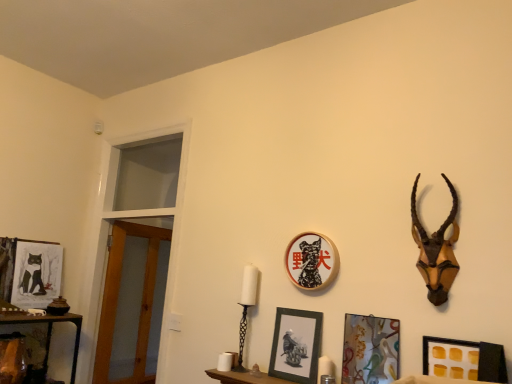
Image resolution: width=512 pixels, height=384 pixels. Describe the element at coordinates (36, 274) in the screenshot. I see `matte black picture frame at left, the first picture frame positioned from the left` at that location.

This screenshot has width=512, height=384. I want to click on metallic glass picture frame at lower right, which appears as the 4th picture frame when viewed from the left, so click(x=370, y=349).

Locate an element on the screen. This screenshot has width=512, height=384. matte black picture frame at center, which is counted as the 3th picture frame, starting from the back is located at coordinates tap(296, 345).

How much space does matte black picture frame at center, which is the 3th picture frame from right to left, occupy horizontally?

matte black picture frame at center, which is the 3th picture frame from right to left, is 2.17 inches in width.

This screenshot has height=384, width=512. Describe the element at coordinates (464, 359) in the screenshot. I see `black matte picture frame at lower right, which is the fifth picture frame in back-to-front order` at that location.

This screenshot has height=384, width=512. I want to click on matte wood shelf at lower center, so click(244, 378).

Is point (381, 370) farther from camera compared to point (18, 268)?

That is False.

Is metallic glass picture frame at lower right, arranged as the 2th picture frame when viewed from the right, positioned with its back to matte black picture frame at left, which is the fifth picture frame from right to left?

metallic glass picture frame at lower right, arranged as the 2th picture frame when viewed from the right, is not turned away from matte black picture frame at left, which is the fifth picture frame from right to left.

From the image's perspective, between metallic glass picture frame at lower right, which appears as the 4th picture frame when viewed from the left, and matte black picture frame at left, the 1th picture frame from the back, which one is located above?

From the image's view, matte black picture frame at left, the 1th picture frame from the back, is above.

Does metallic glass picture frame at lower right, positioned as the second picture frame in front-to-back order, have a lesser width compared to matte black picture frame at left, the first picture frame positioned from the left?

Correct, the width of metallic glass picture frame at lower right, positioned as the second picture frame in front-to-back order, is less than that of matte black picture frame at left, the first picture frame positioned from the left.

Is black matte picture frame at lower right, which is the fifth picture frame in back-to-front order, situated inside matte black picture frame at center, positioned as the third picture frame in left-to-right order, or outside?

black matte picture frame at lower right, which is the fifth picture frame in back-to-front order, is outside matte black picture frame at center, positioned as the third picture frame in left-to-right order.

In the scene shown: Is black matte picture frame at lower right, which is the fifth picture frame in back-to-front order, turned away from matte black picture frame at center, positioned as the third picture frame in left-to-right order?

No, black matte picture frame at lower right, which is the fifth picture frame in back-to-front order,'s orientation is not away from matte black picture frame at center, positioned as the third picture frame in left-to-right order.

From a real-world perspective, which is physically above, black matte picture frame at lower right, which is the fifth picture frame in back-to-front order, or matte black picture frame at center, positioned as the third picture frame in left-to-right order?

matte black picture frame at center, positioned as the third picture frame in left-to-right order.

Can you confirm if black matte picture frame at lower right, arranged as the 5th picture frame when viewed from the left, is smaller than matte black picture frame at center, which is the 3th picture frame from right to left?

Correct, black matte picture frame at lower right, arranged as the 5th picture frame when viewed from the left, occupies less space than matte black picture frame at center, which is the 3th picture frame from right to left.

What's the angular difference between metallic glass picture frame at lower right, positioned as the second picture frame in front-to-back order, and brown wooden antelope head at upper right's facing directions?

The facing directions of metallic glass picture frame at lower right, positioned as the second picture frame in front-to-back order, and brown wooden antelope head at upper right are 0.0532 degrees apart.

From the image's perspective, which picture frame is the 3rd one below the brown wooden antelope head at upper right? Please provide its 2D coordinates.

[(370, 349)]

Considering the points (361, 322) and (456, 238), which point is behind, point (361, 322) or point (456, 238)?

The point (361, 322) is behind.

Can you confirm if matte wood shelf at lower center is smaller than black matte picture frame at lower right, arranged as the 5th picture frame when viewed from the left?

No, matte wood shelf at lower center is not smaller than black matte picture frame at lower right, arranged as the 5th picture frame when viewed from the left.

Is matte wood shelf at lower center in front of black matte picture frame at lower right, which is the fifth picture frame in back-to-front order?

That is False.

Is point (264, 380) farther from viewer compared to point (493, 369)?

Yes, point (264, 380) is behind point (493, 369).

You are a GUI agent. You are given a task and a screenshot of the screen. Output one action in this format:
    pyautogui.click(x=<x>, y=<y>)
    Task: Click on the furniture that is under the black matte picture frame at lower right, which ranks as the 1th picture frame in right-to-left order (from a real-world perspective)
    Image resolution: width=512 pixels, height=384 pixels.
    Given the screenshot: What is the action you would take?
    pyautogui.click(x=244, y=378)

Which is nearer, (327, 249) or (490, 381)?

Point (327, 249) is farther from the camera than point (490, 381).

Looking at this image, from the image's perspective, is matte black picture frame at center, which is the 3th picture frame from right to left, located above or below black matte picture frame at lower right, which ranks as the 1th picture frame in right-to-left order?

Based on their image positions, matte black picture frame at center, which is the 3th picture frame from right to left, is located above black matte picture frame at lower right, which ranks as the 1th picture frame in right-to-left order.

This screenshot has width=512, height=384. In order to click on picture frame that is the 3rd one when counting forward from the matte black picture frame at center, acting as the 2th picture frame starting from the back in this screenshot , I will do `click(464, 359)`.

From a real-world perspective, is matte black picture frame at center, acting as the 2th picture frame starting from the back, on black matte picture frame at lower right, the first picture frame positioned from the front?

Yes, from a real-world perspective, matte black picture frame at center, acting as the 2th picture frame starting from the back, is on top of black matte picture frame at lower right, the first picture frame positioned from the front.

From the image's perspective, which one is positioned lower, brown wooden antelope head at upper right or matte black picture frame at center, positioned as the third picture frame in left-to-right order?

From the image's view, matte black picture frame at center, positioned as the third picture frame in left-to-right order, is below.

Which is closer, (x=432, y=248) or (x=327, y=253)?

The point (x=432, y=248) is more forward.

From a real-world perspective, which is physically above, brown wooden antelope head at upper right or matte black picture frame at center, the fourth picture frame when ordered from front to back?

In real-world perspective, brown wooden antelope head at upper right is above.

Does brown wooden antelope head at upper right have a smaller size compared to matte black picture frame at center, which is the 3th picture frame from right to left?

No.

Looking at this image, does metallic glass picture frame at lower right, arranged as the 2th picture frame when viewed from the right, have a greater width compared to matte wood shelf at lower center?

In fact, metallic glass picture frame at lower right, arranged as the 2th picture frame when viewed from the right, might be narrower than matte wood shelf at lower center.

Between metallic glass picture frame at lower right, which is the 4th picture frame in back-to-front order, and matte wood shelf at lower center, which one has less height?

Standing shorter between the two is matte wood shelf at lower center.

From the image's perspective, which one is positioned lower, metallic glass picture frame at lower right, positioned as the second picture frame in front-to-back order, or matte wood shelf at lower center?

matte wood shelf at lower center.

Is point (394, 348) positioned before point (256, 376)?

Yes, point (394, 348) is closer to viewer.

Locate an element on the screen. the 1st picture frame directly above the metallic glass picture frame at lower right, which appears as the 4th picture frame when viewed from the left (from a real-world perspective) is located at coordinates (36, 274).

Locate an element on the screen. This screenshot has width=512, height=384. the 3rd picture frame below when counting from the matte black picture frame at center, positioned as the third picture frame in left-to-right order (from the image's perspective) is located at coordinates (464, 359).

Considering their positions, is black matte picture frame at lower right, arranged as the 5th picture frame when viewed from the left, positioned closer to metallic glass picture frame at lower right, positioned as the second picture frame in front-to-back order, than matte black picture frame at center, the fourth picture frame when ordered from front to back?

Among the two, black matte picture frame at lower right, arranged as the 5th picture frame when viewed from the left, is located nearer to metallic glass picture frame at lower right, positioned as the second picture frame in front-to-back order.

From the picture: Considering their positions, is matte black picture frame at left, the first picture frame positioned from the left, positioned further to black matte picture frame at lower right, which is the fifth picture frame in back-to-front order, than matte wood shelf at lower center?

matte black picture frame at left, the first picture frame positioned from the left, is further to black matte picture frame at lower right, which is the fifth picture frame in back-to-front order.

From the picture: Which object lies nearer to the anchor point matte black picture frame at center, positioned as the third picture frame in left-to-right order, metallic glass picture frame at lower right, positioned as the second picture frame in front-to-back order, or brown wooden antelope head at upper right?

Based on the image, metallic glass picture frame at lower right, positioned as the second picture frame in front-to-back order, appears to be nearer to matte black picture frame at center, positioned as the third picture frame in left-to-right order.

Based on their spatial positions, is brown wooden antelope head at upper right or matte wood shelf at lower center closer to metallic glass picture frame at lower right, which appears as the 4th picture frame when viewed from the left?

brown wooden antelope head at upper right lies closer to metallic glass picture frame at lower right, which appears as the 4th picture frame when viewed from the left, than the other object.

From the picture: Considering their positions, is matte wood shelf at lower center positioned further to black matte picture frame at lower right, arranged as the 5th picture frame when viewed from the left, than matte black picture frame at left, the first picture frame positioned from the left?

→ Based on the image, matte black picture frame at left, the first picture frame positioned from the left, appears to be further to black matte picture frame at lower right, arranged as the 5th picture frame when viewed from the left.

Based on their spatial positions, is black matte picture frame at lower right, which is the fifth picture frame in back-to-front order, or metallic glass picture frame at lower right, arranged as the 2th picture frame when viewed from the right, closer to matte black picture frame at center, acting as the 2th picture frame starting from the back?

metallic glass picture frame at lower right, arranged as the 2th picture frame when viewed from the right, is positioned closer to the anchor matte black picture frame at center, acting as the 2th picture frame starting from the back.

From the image, which object appears to be farther from brown wooden antelope head at upper right, matte black picture frame at center, acting as the 2th picture frame starting from the back, or matte black picture frame at left, marked as the fifth picture frame in a front-to-back arrangement?

Among the two, matte black picture frame at left, marked as the fifth picture frame in a front-to-back arrangement, is located further to brown wooden antelope head at upper right.

Which object lies nearer to the anchor point brown wooden antelope head at upper right, matte black picture frame at left, the 1th picture frame from the back, or matte wood shelf at lower center?

matte wood shelf at lower center is closer to brown wooden antelope head at upper right.

Where is `furniture between matte black picture frame at left, the first picture frame positioned from the left, and black matte picture frame at lower right, which is the fifth picture frame in back-to-front order, from left to right`? The width and height of the screenshot is (512, 384). furniture between matte black picture frame at left, the first picture frame positioned from the left, and black matte picture frame at lower right, which is the fifth picture frame in back-to-front order, from left to right is located at coordinates (244, 378).

Find the location of a particular element. This screenshot has width=512, height=384. furniture between matte black picture frame at left, the 1th picture frame from the back, and brown wooden antelope head at upper right is located at coordinates (x=244, y=378).

Find the location of a particular element. The height and width of the screenshot is (384, 512). picture frame between matte black picture frame at center, acting as the 2th picture frame starting from the back, and black matte picture frame at lower right, the first picture frame positioned from the front, in the horizontal direction is located at coordinates (370, 349).

The width and height of the screenshot is (512, 384). Identify the location of antelope between matte wood shelf at lower center and black matte picture frame at lower right, arranged as the 5th picture frame when viewed from the left, in the horizontal direction. (436, 250).